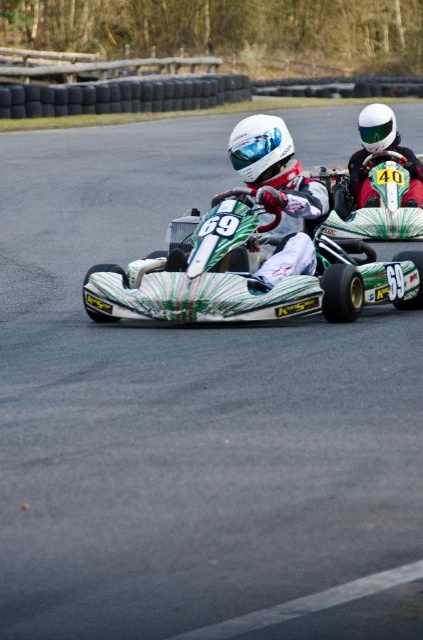
Question: Which point is farther from the camera taking this photo?

Choices:
 (A) (348, 168)
 (B) (198, 282)
 (C) (269, 196)

Answer: (A)

Question: Which object appears farthest from the camera in this image?

Choices:
 (A) green and white painted go-kart at center
 (B) white matte helmet at upper right
 (C) white glossy helmet at center

Answer: (B)

Question: Which point is closer to the camera?

Choices:
 (A) white matte helmet at upper right
 (B) green and white painted go-kart at center
 (C) white glossy helmet at center

Answer: (B)

Question: Is green and white painted go-kart at center in front of white matte helmet at upper right?

Choices:
 (A) yes
 (B) no

Answer: (A)

Question: Is white glossy helmet at center positioned behind white matte helmet at upper right?

Choices:
 (A) yes
 (B) no

Answer: (B)

Question: Is green and white painted go-kart at center smaller than white glossy helmet at center?

Choices:
 (A) yes
 (B) no

Answer: (B)